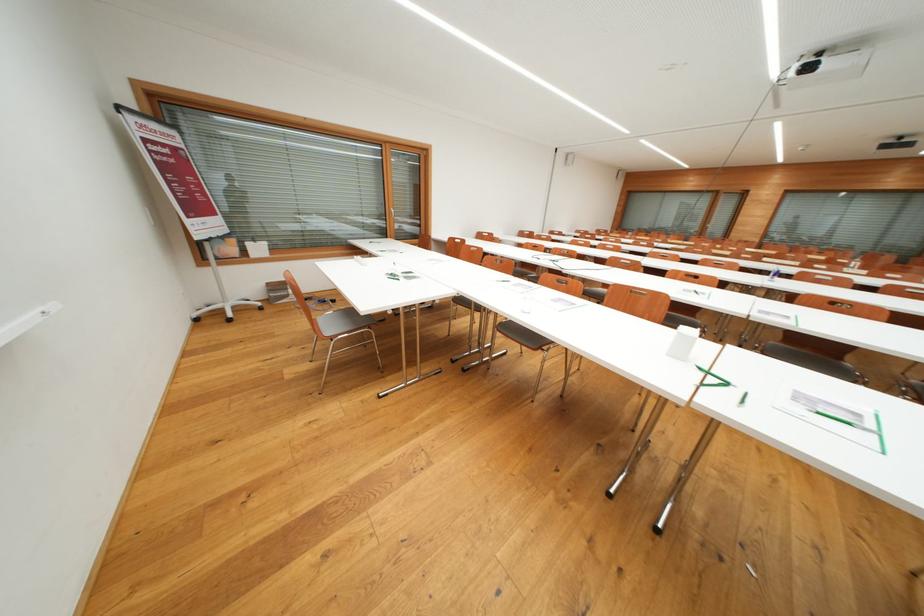
Which object does [879,434] point to?

It corresponds to the green pen in the image.